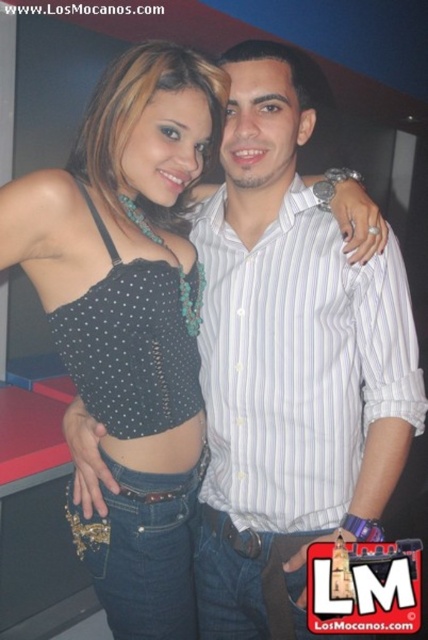
Question: Is black matte tank top at center positioned in front of white striped shirt at center?

Choices:
 (A) yes
 (B) no

Answer: (A)

Question: Which point appears farthest from the camera in this image?

Choices:
 (A) (106, 412)
 (B) (294, 337)

Answer: (B)

Question: Can you confirm if black matte tank top at center is smaller than white striped shirt at center?

Choices:
 (A) yes
 (B) no

Answer: (B)

Question: Which point is farther from the camera taking this photo?

Choices:
 (A) (115, 308)
 (B) (324, 284)

Answer: (B)

Question: Which point is closer to the camera taking this photo?

Choices:
 (A) (234, 250)
 (B) (80, 547)

Answer: (B)

Question: In this image, where is black matte tank top at center located relative to white striped shirt at center?

Choices:
 (A) above
 (B) below

Answer: (B)